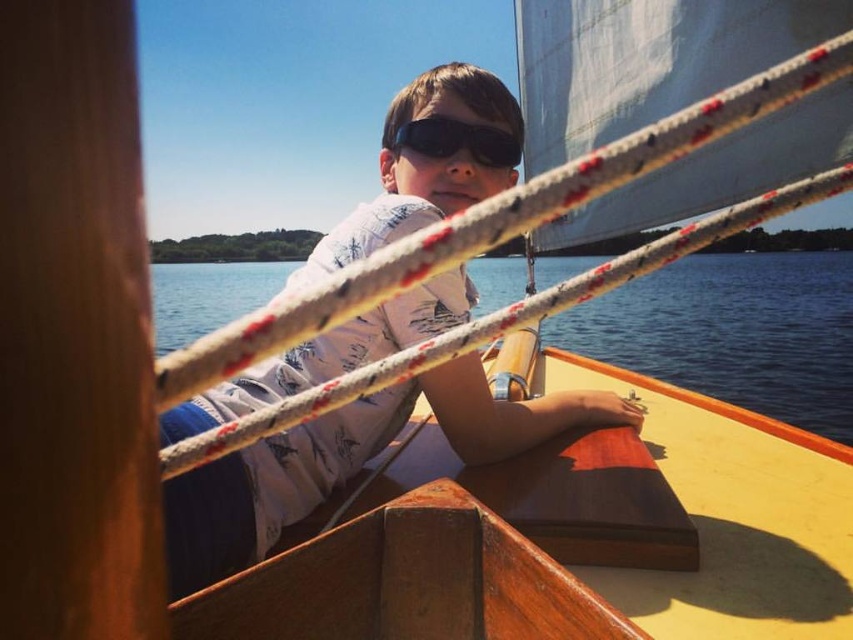
Based on the photo, you are a sailor trying to secure your equipment on the sailboat. You have a clear blue water at center and a black matte goggles at center. Which object is wider?

The clear blue water at center is wider than the black matte goggles at center according to the description.

You are a photographer trying to capture the boy on the sailboat. You notice a specific point at coordinates point [347,461]. Based on the scene, what object is this point located on?

The point [347,461] is located on the white cotton shirt at center.